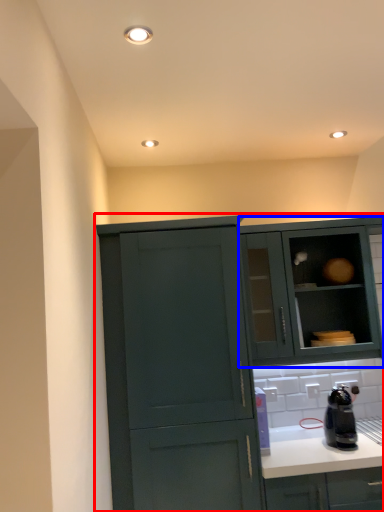
Question: Which object is further to the camera taking this photo, cabinetry (highlighted by a red box) or cabinetry (highlighted by a blue box)?

Choices:
 (A) cabinetry
 (B) cabinetry

Answer: (B)